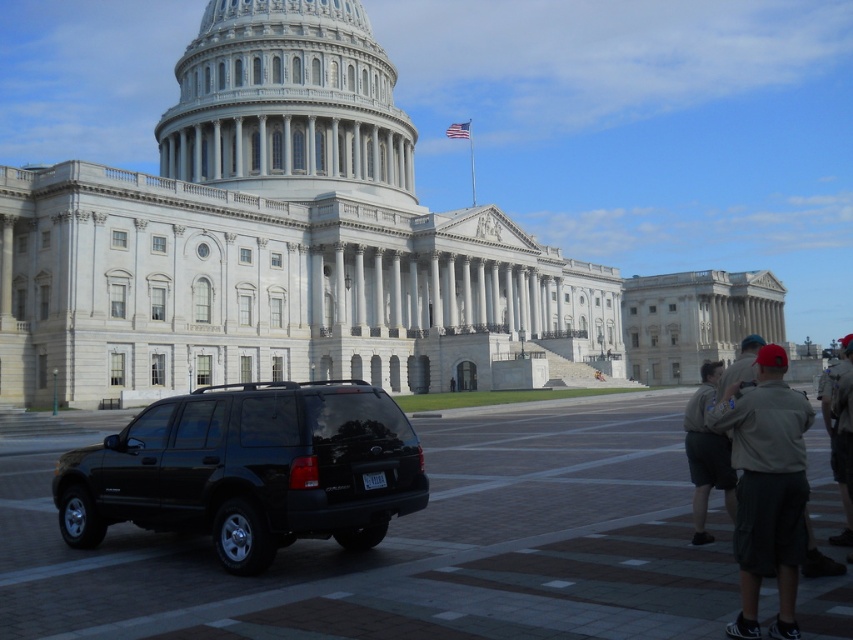
From the picture: Between black matte suv at center and khaki shorts at lower right, which one appears on the left side from the viewer's perspective?

From the viewer's perspective, black matte suv at center appears more on the left side.

Is point (405, 502) farther from viewer compared to point (699, 419)?

No, (405, 502) is in front of (699, 419).

Is point (376, 497) farther from camera compared to point (711, 387)?

No, (376, 497) is closer to viewer.

The image size is (853, 640). In order to click on black matte suv at center in this screenshot , I will do `click(248, 468)`.

I want to click on khaki uniform at right, so click(x=767, y=488).

Who is positioned more to the left, khaki uniform at right or khaki uniform at lower right?

khaki uniform at right is more to the left.

Image resolution: width=853 pixels, height=640 pixels. In order to click on khaki uniform at right in this screenshot , I will do `click(767, 488)`.

Can you confirm if khaki uniform at right is shorter than khaki shorts at lower right?

No, khaki uniform at right is not shorter than khaki shorts at lower right.

The image size is (853, 640). What are the coordinates of `khaki uniform at right` in the screenshot? It's located at (767, 488).

Locate an element on the screen. khaki uniform at right is located at coordinates (767, 488).